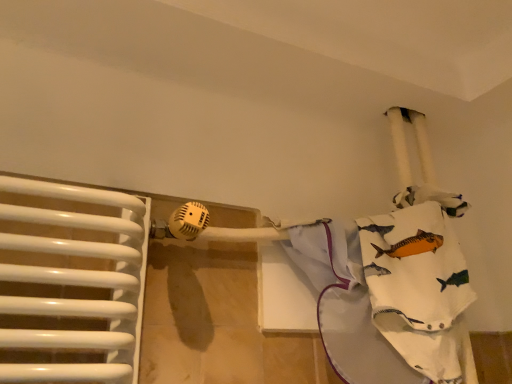
Find the location of a particular element. white cotton laundry at upper right is located at coordinates (391, 291).

Describe the element at coordinates (391, 291) in the screenshot. I see `white cotton laundry at upper right` at that location.

Locate an element on the screen. This screenshot has width=512, height=384. white cotton laundry at upper right is located at coordinates (391, 291).